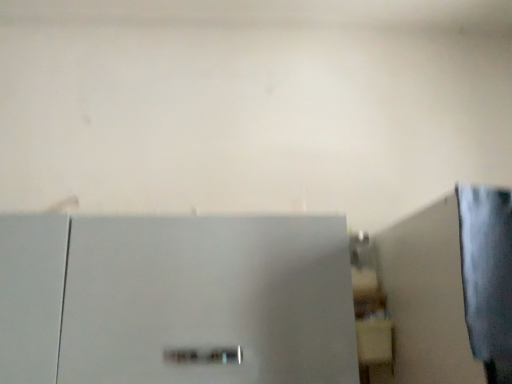
Question: Should I look upward or downward to see matte white shelf at center-right?

Choices:
 (A) down
 (B) up

Answer: (A)

Question: Can you confirm if matte white shelf at center-right is shorter than satin silver refrigerator at center?

Choices:
 (A) no
 (B) yes

Answer: (B)

Question: Is matte white shelf at center-right not near satin silver refrigerator at center?

Choices:
 (A) no
 (B) yes

Answer: (A)

Question: Considering the relative positions of matte white shelf at center-right and satin silver refrigerator at center in the image provided, is matte white shelf at center-right to the left of satin silver refrigerator at center from the viewer's perspective?

Choices:
 (A) yes
 (B) no

Answer: (B)

Question: From a real-world perspective, is matte white shelf at center-right over satin silver refrigerator at center?

Choices:
 (A) yes
 (B) no

Answer: (A)

Question: Is matte white shelf at center-right in contact with satin silver refrigerator at center?

Choices:
 (A) yes
 (B) no

Answer: (B)

Question: Is matte white shelf at center-right completely or partially outside of satin silver refrigerator at center?

Choices:
 (A) yes
 (B) no

Answer: (A)

Question: From the image's perspective, is satin silver refrigerator at center located beneath matte white shelf at center-right?

Choices:
 (A) no
 (B) yes

Answer: (B)

Question: Is satin silver refrigerator at center taller than matte white shelf at center-right?

Choices:
 (A) yes
 (B) no

Answer: (A)

Question: Is satin silver refrigerator at center turned away from matte white shelf at center-right?

Choices:
 (A) yes
 (B) no

Answer: (B)

Question: From a real-world perspective, is satin silver refrigerator at center under matte white shelf at center-right?

Choices:
 (A) yes
 (B) no

Answer: (A)

Question: Is satin silver refrigerator at center to the right of matte white shelf at center-right from the viewer's perspective?

Choices:
 (A) yes
 (B) no

Answer: (B)

Question: Does satin silver refrigerator at center come in front of matte white shelf at center-right?

Choices:
 (A) no
 (B) yes

Answer: (B)

Question: From the image's perspective, relative to matte white shelf at center-right, is satin silver refrigerator at center above or below?

Choices:
 (A) below
 (B) above

Answer: (A)